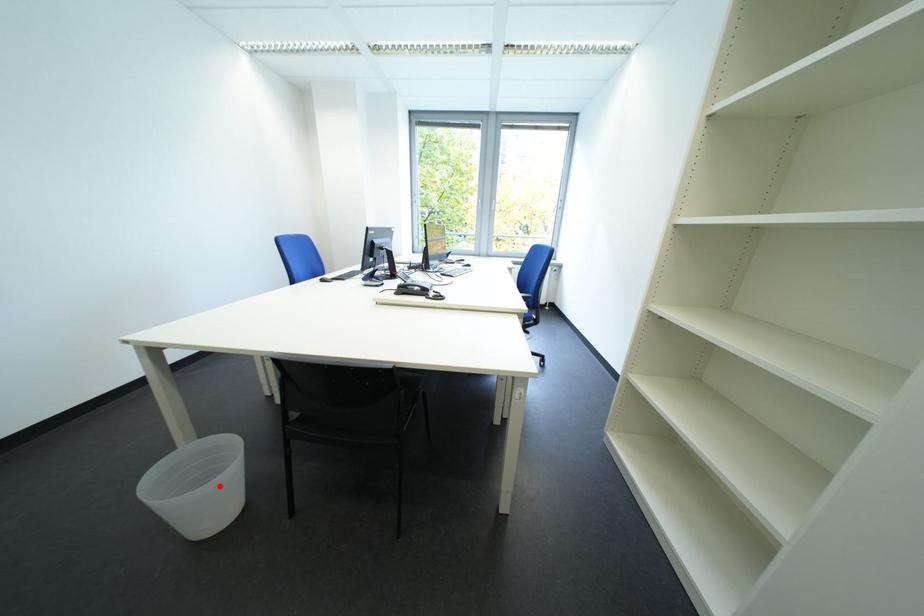
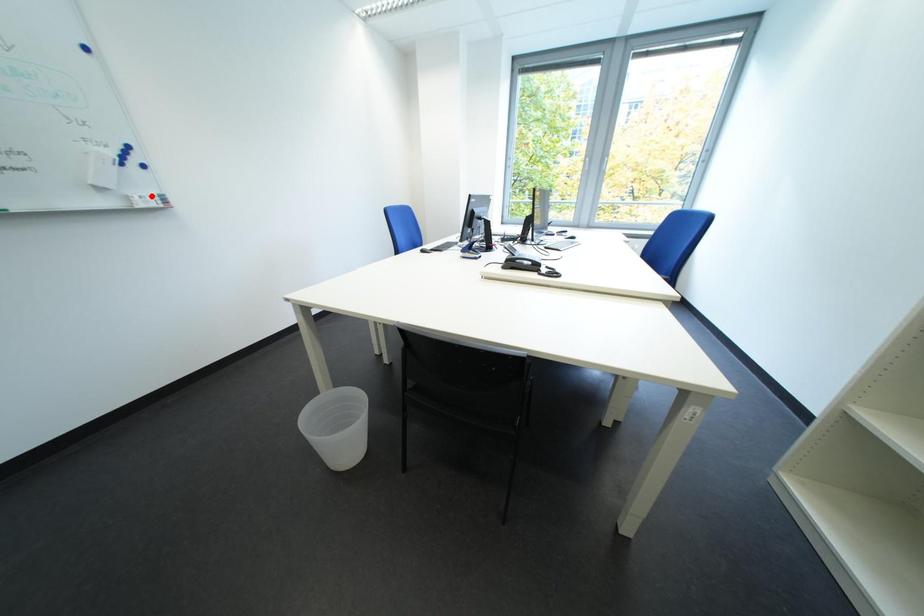
I am providing you with two images of the same scene from different viewpoints. A red point is marked on the first image and another point is marked on the second image. Do the highlighted points in image1 and image2 indicate the same real-world spot?

No